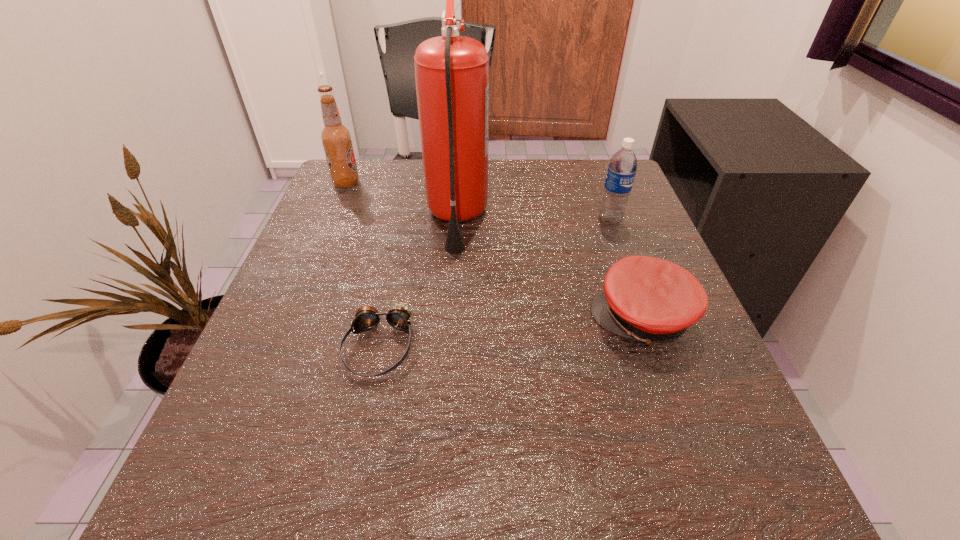
Identify the location of blank space that satisfies the following two spatial constraints: 1. on the front of the fourth tallest object with an emblem; 2. through the lenses of the shortest object. (652, 347).

Where is `free space that satisfies the following two spatial constraints: 1. on the instruction side of the fire extinguisher; 2. on the left side of the third shortest object`? The width and height of the screenshot is (960, 540). free space that satisfies the following two spatial constraints: 1. on the instruction side of the fire extinguisher; 2. on the left side of the third shortest object is located at coordinates (457, 220).

Where is `blank space that satisfies the following two spatial constraints: 1. on the front of the cap with an emblem; 2. through the lenses of the shortest object`? The image size is (960, 540). blank space that satisfies the following two spatial constraints: 1. on the front of the cap with an emblem; 2. through the lenses of the shortest object is located at coordinates (652, 347).